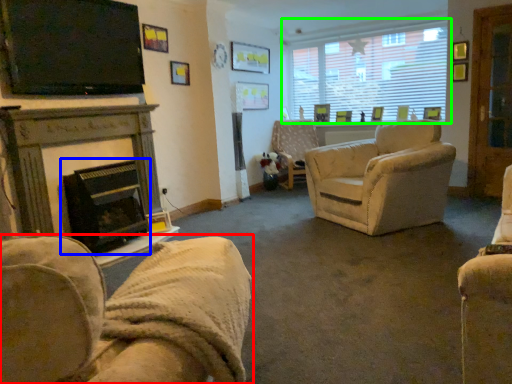
Question: Estimate the real-world distances between objects in this image. Which object is closer to chair (highlighted by a red box), fireplace (highlighted by a blue box) or window (highlighted by a green box)?

Choices:
 (A) fireplace
 (B) window

Answer: (A)